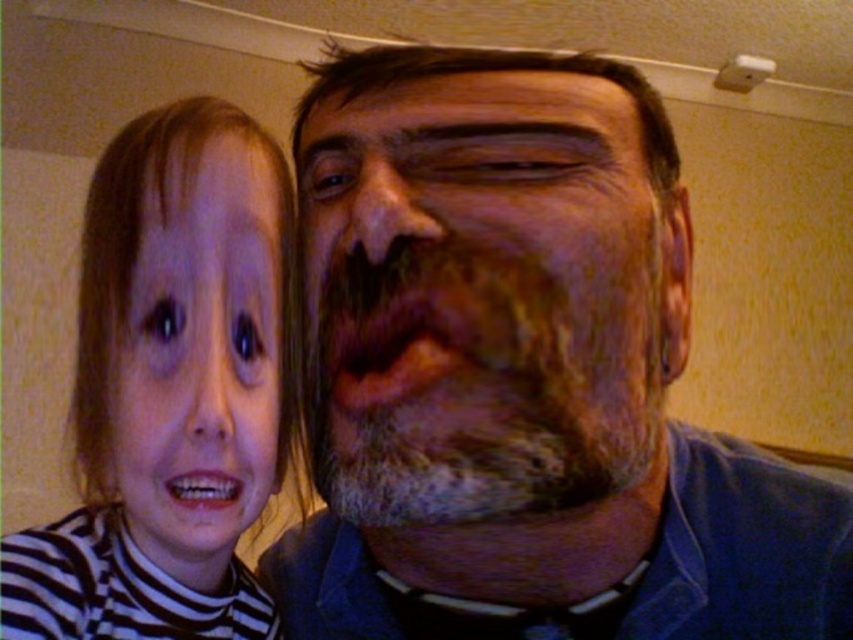
You are standing in the room where the two people are. You want to place a small gift between the two points marked as point (582, 134) and point (265, 627). Since you want the gift to be closer to the person who is farther away from you, which point should you place it near?

Point (265, 627) is farther from the viewer than point (582, 134). To place the gift closer to the person who is farther away, you should place it near point (265, 627).